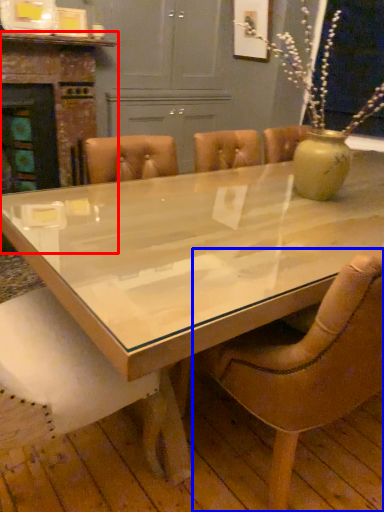
Question: Which point is closer to the camera, fireplace (highlighted by a red box) or chair (highlighted by a blue box)?

Choices:
 (A) fireplace
 (B) chair

Answer: (B)